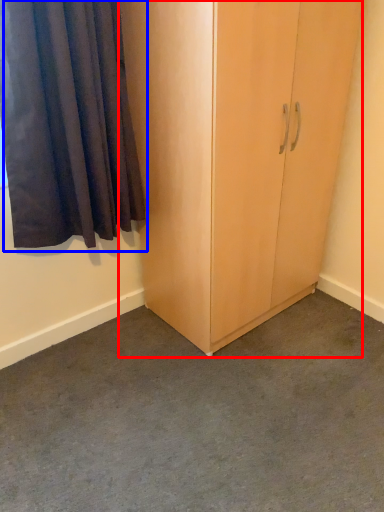
Question: Which object is further to the camera taking this photo, cupboard (highlighted by a red box) or curtain (highlighted by a blue box)?

Choices:
 (A) cupboard
 (B) curtain

Answer: (A)